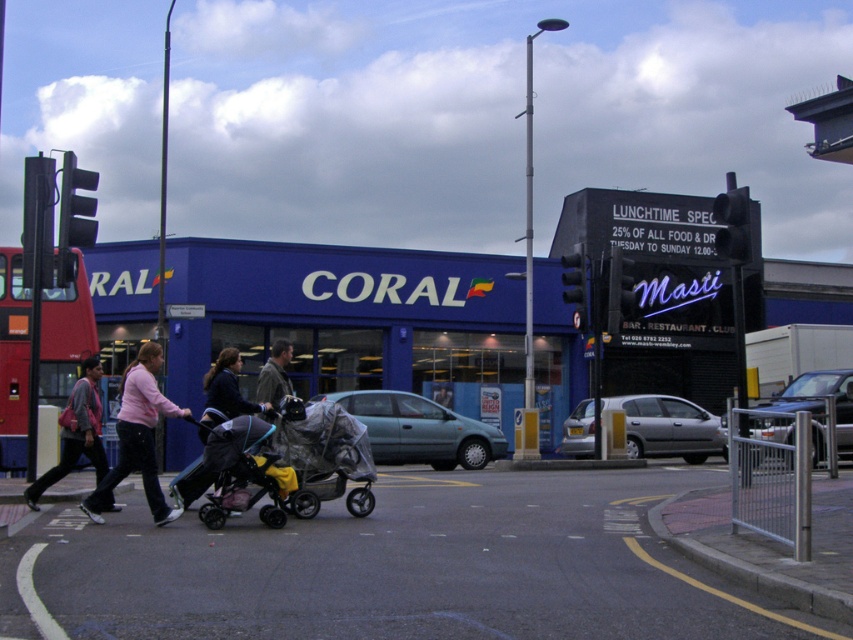
Based on the photo, is blue matte store at center closer to the viewer compared to matte pink sweater at center?

No, it is not.

Is point (556, 346) positioned in front of point (149, 468)?

No, it is not.

Between point (479, 259) and point (138, 445), which one is positioned in front?

Positioned in front is point (138, 445).

Find the location of a particular element. blue matte store at center is located at coordinates (352, 320).

Is metallic blue hatchback at center thinner than silver metallic hatchback at center?

No.

Does metallic blue hatchback at center appear over silver metallic hatchback at center?

Incorrect, metallic blue hatchback at center is not positioned above silver metallic hatchback at center.

Which is behind, point (480, 424) or point (631, 444)?

The point (631, 444) is more distant.

Identify the location of metallic blue hatchback at center. Image resolution: width=853 pixels, height=640 pixels. (421, 429).

Does silver metallic hatchback at center appear under brown leather jacket at center?

Yes.

Where is `silver metallic hatchback at center`? This screenshot has height=640, width=853. silver metallic hatchback at center is located at coordinates (668, 428).